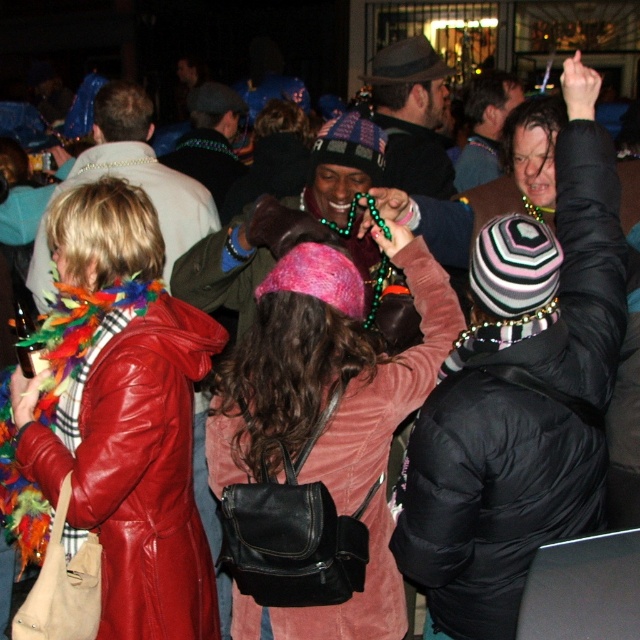
Can you confirm if leather jacket at center is positioned below pink corduroy sweater at center?

Yes.

From the picture: Which of these two, leather jacket at center or pink corduroy sweater at center, stands taller?

Standing taller between the two is leather jacket at center.

Between point (124, 195) and point (390, 433), which one is positioned behind?

The point (124, 195) is behind.

Locate an element on the screen. This screenshot has height=640, width=640. leather jacket at center is located at coordinates (109, 429).